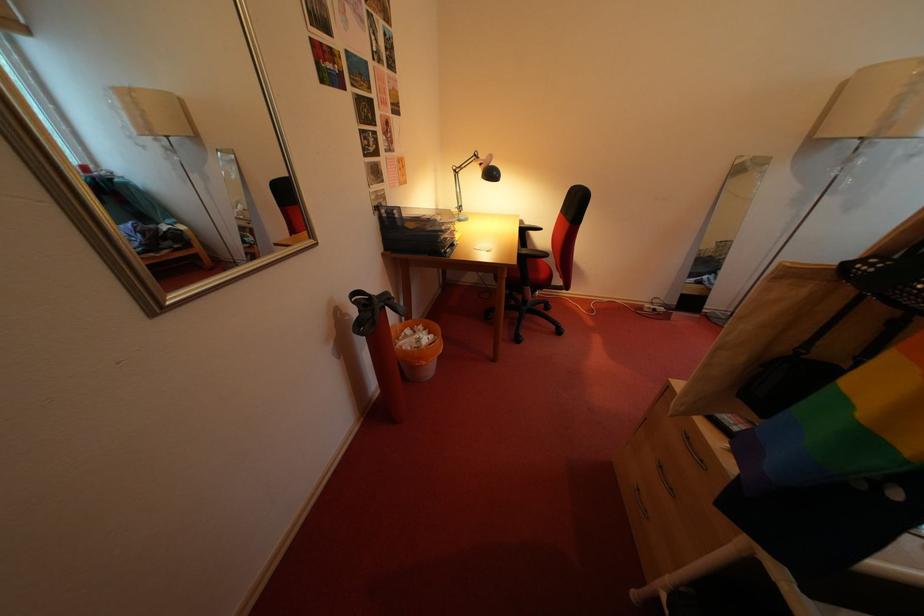
Find where to resting arm the black chair armrest. Please return your answer as a coordinate pair (x, y).

(529, 256)